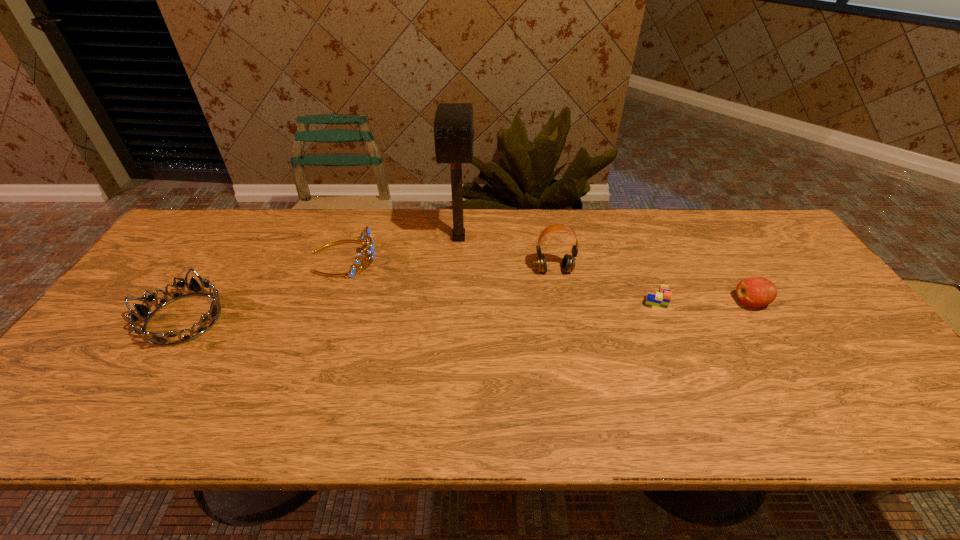
Locate an element on the screen. The image size is (960, 540). unoccupied area between the Lego and the right tiara is located at coordinates (500, 279).

Where is `blank region between the nearer tiara and the second tallest object`? Image resolution: width=960 pixels, height=540 pixels. blank region between the nearer tiara and the second tallest object is located at coordinates (369, 295).

You are a GUI agent. You are given a task and a screenshot of the screen. Output one action in this format:
    pyautogui.click(x=<x>, y=<y>)
    Task: Click on the blank region between the right tiara and the rightmost object
    
    Given the screenshot: What is the action you would take?
    pyautogui.click(x=547, y=280)

Locate an element on the screen. The image size is (960, 540). object that is the second nearest to the apple is located at coordinates (568, 263).

You are a GUI agent. You are given a task and a screenshot of the screen. Output one action in this format:
    pyautogui.click(x=<x>, y=<y>)
    Task: Click on the object that ranks as the second closest to the rightmost object
    This screenshot has height=540, width=960.
    Given the screenshot: What is the action you would take?
    pyautogui.click(x=568, y=263)

At what (x,y) coordinates should I click in order to perform the action: click on blank space that satisfies the following two spatial constraints: 1. on the back side of the fifth object from left to right; 2. on the front-facing side of the fifth object from right to left. Please return your answer as a coordinate pair (x, y). This screenshot has height=540, width=960. Looking at the image, I should click on (640, 258).

Locate an element on the screen. free spot that satisfies the following two spatial constraints: 1. on the front-facing side of the farther tiara; 2. on the front-facing side of the shorter tiara is located at coordinates (323, 319).

Identify the location of free region that satisfies the following two spatial constraints: 1. on the ear cups of the fourth object from left to right; 2. on the right side of the rightmost object. (560, 302).

This screenshot has width=960, height=540. Find the location of `free space that satisfies the following two spatial constraints: 1. on the front-facing side of the taller tiara; 2. on the left side of the Lego`. free space that satisfies the following two spatial constraints: 1. on the front-facing side of the taller tiara; 2. on the left side of the Lego is located at coordinates (329, 299).

Locate an element on the screen. The image size is (960, 540). free space in the image that satisfies the following two spatial constraints: 1. on the front side of the fifth object from left to right; 2. on the left side of the mallet is located at coordinates point(455,299).